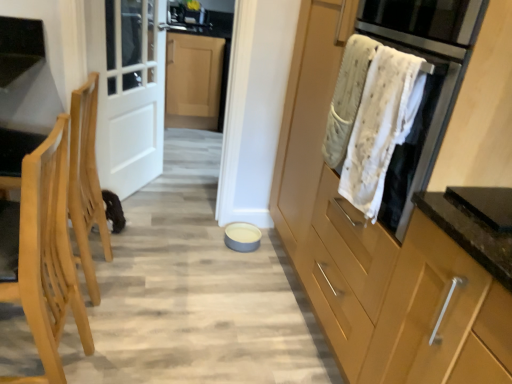
At what (x,y) coordinates should I click in order to perform the action: click on matte wood cabinet at center. Please return your answer as a coordinate pair (x, y). Looking at the image, I should click on (385, 253).

The height and width of the screenshot is (384, 512). What do you see at coordinates (42, 254) in the screenshot? I see `light wood chair at left` at bounding box center [42, 254].

What is the approximate width of matte white sink at upper center?

It is 16.79 centimeters.

The height and width of the screenshot is (384, 512). Describe the element at coordinates (242, 237) in the screenshot. I see `white matte bowl at center` at that location.

Locate an element on the screen. The width and height of the screenshot is (512, 384). white matte bowl at center is located at coordinates (242, 237).

Identify the location of white textured towel at upper right. (370, 117).

You are a GUI agent. You are given a task and a screenshot of the screen. Output one action in this format:
    pyautogui.click(x=<x>, y=<y>)
    Task: Click on the matte wood cabinet at center
    
    Given the screenshot: What is the action you would take?
    pos(385,253)

Considering the relative sizes of matte wood cabinet at center and light wood chair at left in the image provided, is matte wood cabinet at center smaller than light wood chair at left?

Actually, matte wood cabinet at center might be larger than light wood chair at left.

Identify the location of cabinetry in front of the light wood chair at left. (385, 253).

Looking at this image, from the image's perspective, does matte wood cabinet at center appear higher than light wood chair at left?

Yes, from the image's perspective, matte wood cabinet at center is over light wood chair at left.

Can you see clear glass door at upper left touching light wood chair at left?

They are not placed beside each other.

From the image's perspective, which one is positioned lower, clear glass door at upper left or light wood chair at left?

From the image's view, light wood chair at left is below.

Is clear glass door at upper left facing towards light wood chair at left?

No, clear glass door at upper left does not turn towards light wood chair at left.

Are white matte bowl at center and white textured towel at upper right located far from each other?

Absolutely, white matte bowl at center is distant from white textured towel at upper right.

Considering the sizes of objects white matte bowl at center and white textured towel at upper right in the image provided, who is shorter, white matte bowl at center or white textured towel at upper right?

white matte bowl at center is shorter.

From the picture: From a real-world perspective, is white matte bowl at center located higher than white textured towel at upper right?

Result: No, from a real-world perspective, white matte bowl at center is not over white textured towel at upper right

Is white matte bowl at center at the right side of white textured towel at upper right?

No.

Is white textured towel at upper right a part of white matte bowl at center?

Actually, white textured towel at upper right is outside white matte bowl at center.

Looking at this image, is white matte bowl at center placed right next to white textured towel at upper right?

white matte bowl at center is not next to white textured towel at upper right, and they're not touching.

Is white matte bowl at center facing towards white textured towel at upper right?

No, white matte bowl at center is not oriented towards white textured towel at upper right.

Is white textured towel at upper right facing away from clear glass door at upper left?

No, white textured towel at upper right is not facing away from clear glass door at upper left.

Find the location of a particular element. window directly beneath the white textured towel at upper right (from a real-world perspective) is located at coordinates (130, 43).

Which is more to the right, white textured towel at upper right or clear glass door at upper left?

white textured towel at upper right is more to the right.

From a real-world perspective, is white textured towel at upper right under clear glass door at upper left?

No.

Is white textured towel at upper right taller or shorter than light wood chair at left?

Clearly, white textured towel at upper right is shorter compared to light wood chair at left.

Which object is more forward, white textured towel at upper right or light wood chair at left?

light wood chair at left.

Who is bigger, white textured towel at upper right or light wood chair at left?

With larger size is light wood chair at left.

Is white textured towel at upper right to the left of light wood chair at left from the viewer's perspective?

No.

From the picture: Is white textured towel at upper right in front of or behind white matte bowl at center in the image?

Clearly, white textured towel at upper right is in front of white matte bowl at center.

Is white textured towel at upper right bigger than white matte bowl at center?

Yes, white textured towel at upper right is bigger than white matte bowl at center.

Looking at their sizes, would you say white textured towel at upper right is wider or thinner than white matte bowl at center?

In the image, white textured towel at upper right appears to be more narrow than white matte bowl at center.

The width and height of the screenshot is (512, 384). In order to click on cabinetry that is in front of the light wood chair at left in this screenshot , I will do `click(385, 253)`.

The width and height of the screenshot is (512, 384). Identify the location of window above the light wood chair at left (from a real-world perspective). (130, 43).

Based on the photo, from the image, which object appears to be farther from light wood chair at left, white matte bowl at center or matte wood cabinet at center?

Among the two, white matte bowl at center is located further to light wood chair at left.

From the picture: Estimate the real-world distances between objects in this image. Which object is closer to matte wood cabinet at center, white textured towel at upper right or white matte bowl at center?

The object closer to matte wood cabinet at center is white textured towel at upper right.

When comparing their distances from matte white sink at upper center, does light wood chair at left or white textured towel at upper right seem further?

Among the two, light wood chair at left is located further to matte white sink at upper center.

When comparing their distances from clear glass door at upper left, does white textured towel at upper right or matte white sink at upper center seem closer?

Among the two, white textured towel at upper right is located nearer to clear glass door at upper left.

From the image, which object appears to be nearer to light wood chair at left, clear glass door at upper left or white matte bowl at center?

white matte bowl at center lies closer to light wood chair at left than the other object.

Estimate the real-world distances between objects in this image. Which object is closer to matte white sink at upper center, light wood chair at left or matte wood cabinet at center?

The object closer to matte white sink at upper center is matte wood cabinet at center.

Looking at the image, which one is located closer to white textured towel at upper right, white matte bowl at center or matte wood cabinet at center?

matte wood cabinet at center lies closer to white textured towel at upper right than the other object.

Based on their spatial positions, is white textured towel at upper right or matte wood cabinet at center closer to white matte bowl at center?

Among the two, matte wood cabinet at center is located nearer to white matte bowl at center.

Where is `laundry between light wood chair at left and white wood door at left along the z-axis`? This screenshot has height=384, width=512. laundry between light wood chair at left and white wood door at left along the z-axis is located at coordinates (347, 98).

Find the location of a particular element. appliance between white textured towel at upper right and matte white sink at upper center from front to back is located at coordinates (242, 237).

Where is `laundry between matte wood cabinet at center and clear glass door at upper left in the front-back direction`? The width and height of the screenshot is (512, 384). laundry between matte wood cabinet at center and clear glass door at upper left in the front-back direction is located at coordinates click(347, 98).

Identify the location of blanket between matte wood cabinet at center and white matte bowl at center from front to back. (370, 117).